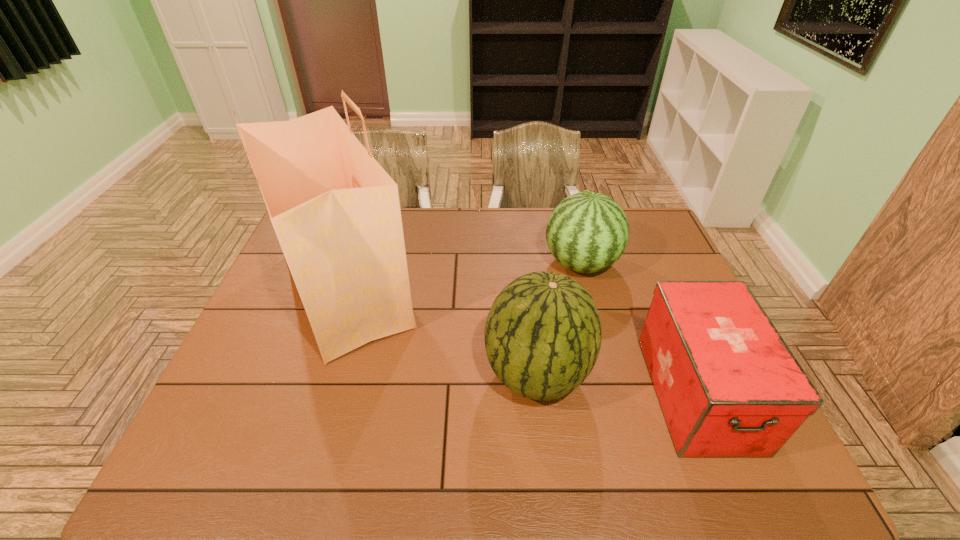
Image resolution: width=960 pixels, height=540 pixels. In order to click on free location that satisfies the following two spatial constraints: 1. on the front side of the farther watermelon; 2. on the side of the leftmost object with the superhero design in this screenshot , I will do `click(588, 291)`.

The width and height of the screenshot is (960, 540). What are the coordinates of `free space that satisfies the following two spatial constraints: 1. on the back side of the nearer watermelon; 2. on the side of the tallest object with the superhero design` in the screenshot? It's located at (527, 291).